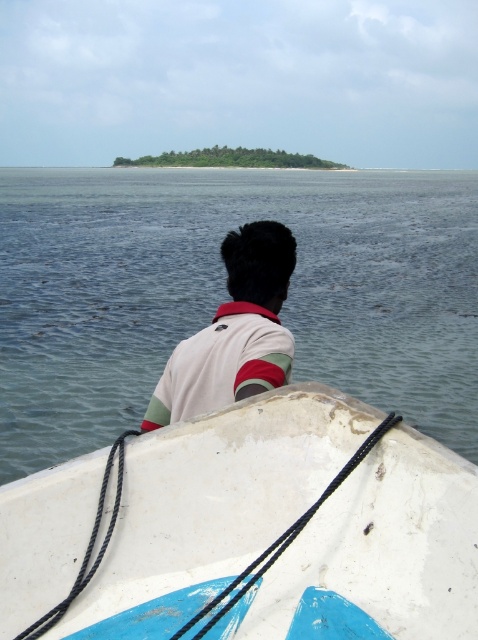
Question: Is white matte boat at center bigger than white cotton shirt at center?

Choices:
 (A) no
 (B) yes

Answer: (B)

Question: Does white matte boat at center appear over white cotton shirt at center?

Choices:
 (A) yes
 (B) no

Answer: (B)

Question: Which object is the closest to the clear water at center?

Choices:
 (A) white cotton shirt at center
 (B) white matte boat at center

Answer: (B)

Question: Among these objects, which one is farthest from the camera?

Choices:
 (A) white cotton shirt at center
 (B) white matte boat at center
 (C) clear water at center

Answer: (C)

Question: Is clear water at center closer to camera compared to white matte boat at center?

Choices:
 (A) yes
 (B) no

Answer: (B)

Question: Which point is closer to the camera?

Choices:
 (A) white matte boat at center
 (B) clear water at center

Answer: (A)